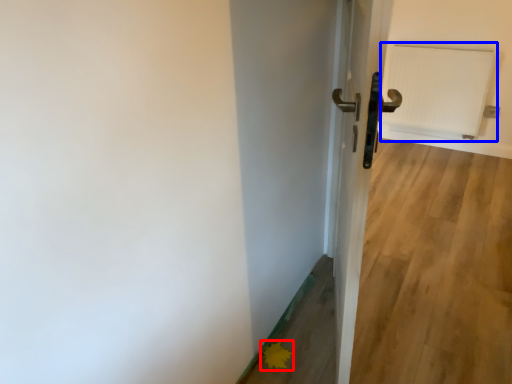
Question: Which object is further to the camera taking this photo, flower (highlighted by a red box) or radiator (highlighted by a blue box)?

Choices:
 (A) flower
 (B) radiator

Answer: (B)